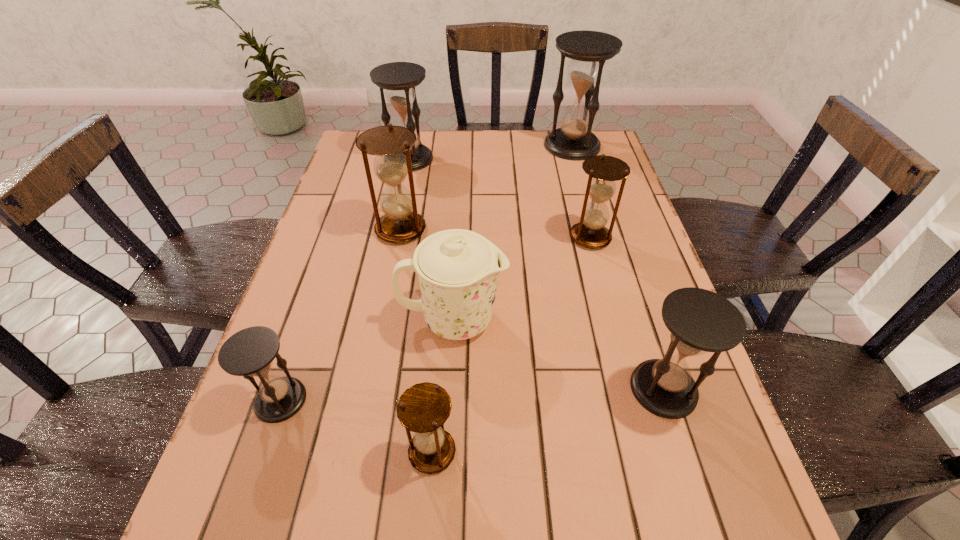
The image size is (960, 540). I want to click on vacant point located between the leftmost brown hourglass and the rightmost brown hourglass, so click(x=495, y=233).

Locate an element on the screen. empty space between the fourth nearest object and the fourth hourglass from right to left is located at coordinates (443, 386).

Locate an element on the screen. This screenshot has width=960, height=540. object that is the second closest to the leftmost hourglass is located at coordinates (423, 408).

Locate which object ranks fourth in proximity to the second smallest brown hourglass. Please provide its 2D coordinates. Your answer should be formatted as a tuple, i.e. [(x, y)], where the tuple contains the x and y coordinates of a point satisfying the conditions above.

[(401, 223)]

Choose which hourglass is the fourth nearest neighbor to the leftmost hourglass. Please provide its 2D coordinates. Your answer should be formatted as a tuple, i.e. [(x, y)], where the tuple contains the x and y coordinates of a point satisfying the conditions above.

[(590, 232)]

Locate an element on the screen. The image size is (960, 540). hourglass that stands as the fifth closest to the leftmost object is located at coordinates (399, 79).

Select which black hourglass is the third closest to the third smallest black hourglass. Please provide its 2D coordinates. Your answer should be formatted as a tuple, i.e. [(x, y)], where the tuple contains the x and y coordinates of a point satisfying the conditions above.

[(700, 321)]

Identify which black hourglass is the second nearest to the tallest hourglass. Please provide its 2D coordinates. Your answer should be formatted as a tuple, i.e. [(x, y)], where the tuple contains the x and y coordinates of a point satisfying the conditions above.

[(700, 321)]

Identify which brown hourglass is the second closest to the fourth hourglass from right to left. Please provide its 2D coordinates. Your answer should be formatted as a tuple, i.e. [(x, y)], where the tuple contains the x and y coordinates of a point satisfying the conditions above.

[(590, 232)]

Identify which brown hourglass is located as the third nearest to the chinaware. Please provide its 2D coordinates. Your answer should be formatted as a tuple, i.e. [(x, y)], where the tuple contains the x and y coordinates of a point satisfying the conditions above.

[(590, 232)]